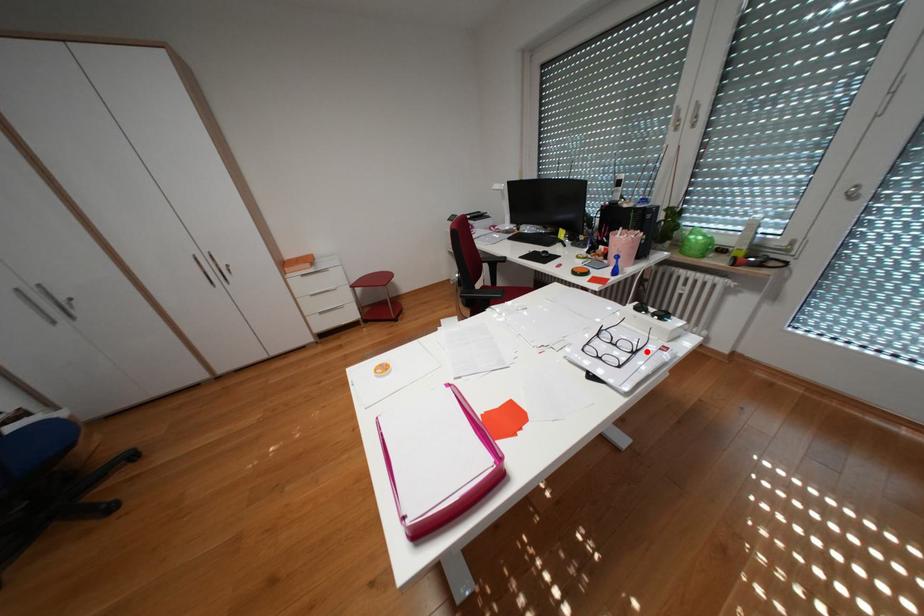
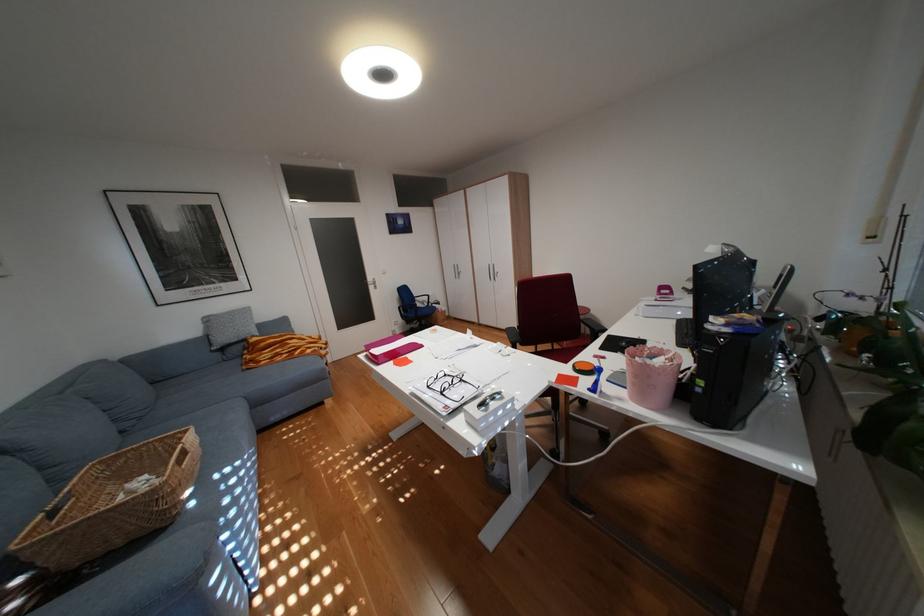
Find the pixel in the second image that matches the highlighted location in the first image.

(454, 392)